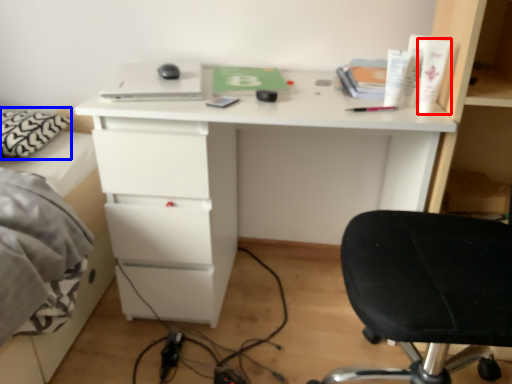
Question: Which point is further to the camera, toiletry (highlighted by a red box) or pillow (highlighted by a blue box)?

Choices:
 (A) toiletry
 (B) pillow

Answer: (B)